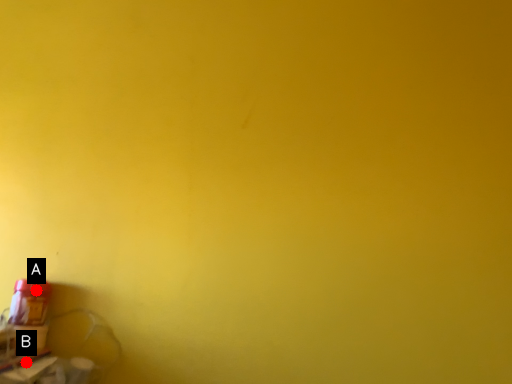
Question: Two points are circled on the image, labeled by A and B beside each circle. Which of the following is the farthest from the observer?

Choices:
 (A) A is further
 (B) B is further

Answer: (A)